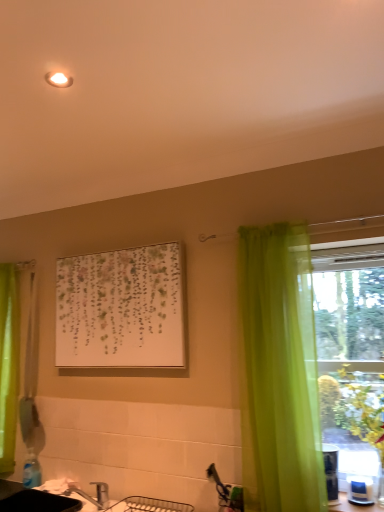
Question: In terms of height, does green sheer curtain at left, placed as the second curtain when sorted from front to back, look taller or shorter compared to brushed metal faucet at lower left?

Choices:
 (A) short
 (B) tall

Answer: (B)

Question: From a real-world perspective, is green sheer curtain at left, placed as the second curtain when sorted from front to back, above or below brushed metal faucet at lower left?

Choices:
 (A) below
 (B) above

Answer: (B)

Question: Which object is positioned farthest from the black matte sink at lower left?

Choices:
 (A) brushed metal faucet at lower left
 (B) white matte picture frame at center
 (C) green leafy plant at right
 (D) white glossy counter top at lower right
 (E) green sheer curtain at left, which is counted as the 1th curtain, starting from the back

Answer: (C)

Question: Which object is positioned closest to the green sheer curtain at left, which is counted as the 1th curtain, starting from the back?

Choices:
 (A) white matte picture frame at center
 (B) brushed metal faucet at lower left
 (C) green leafy plant at right
 (D) translucent green curtain at right, which is counted as the 2th curtain, starting from the back
 (E) black matte sink at lower left

Answer: (E)